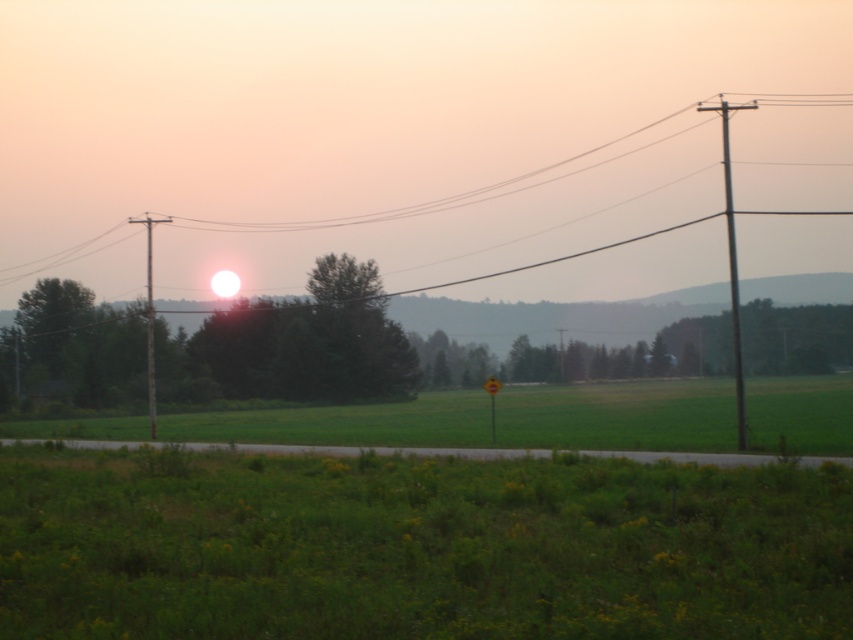
Question: Observing the image, what is the correct spatial positioning of metallic wire at upper center in reference to yellow plastic sign at center?

Choices:
 (A) below
 (B) above

Answer: (B)

Question: Which point is farther to the camera?

Choices:
 (A) (22, 300)
 (B) (149, 426)
 (C) (498, 186)

Answer: (C)

Question: Is green grassy field at center thinner than green leafy tree at left?

Choices:
 (A) yes
 (B) no

Answer: (B)

Question: Which object is closer to the camera taking this photo?

Choices:
 (A) brown wooden telegraph pole at left
 (B) green grassy field at center
 (C) metallic wire at upper center
 (D) smooth wood telegraph pole at right

Answer: (B)

Question: Among these points, which one is nearest to the camera?

Choices:
 (A) (486, 387)
 (B) (25, 300)
 (C) (646, 396)

Answer: (A)

Question: Is smooth wood telegraph pole at right to the right of yellow plastic sign at center from the viewer's perspective?

Choices:
 (A) no
 (B) yes

Answer: (B)